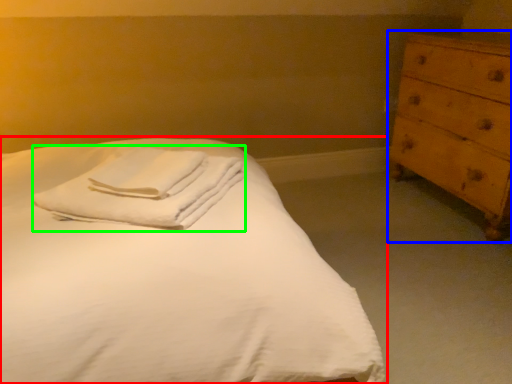
Question: Which object is positioned farthest from bed (highlighted by a red box)? Select from chest of drawers (highlighted by a blue box) and material (highlighted by a green box).

Choices:
 (A) chest of drawers
 (B) material

Answer: (A)